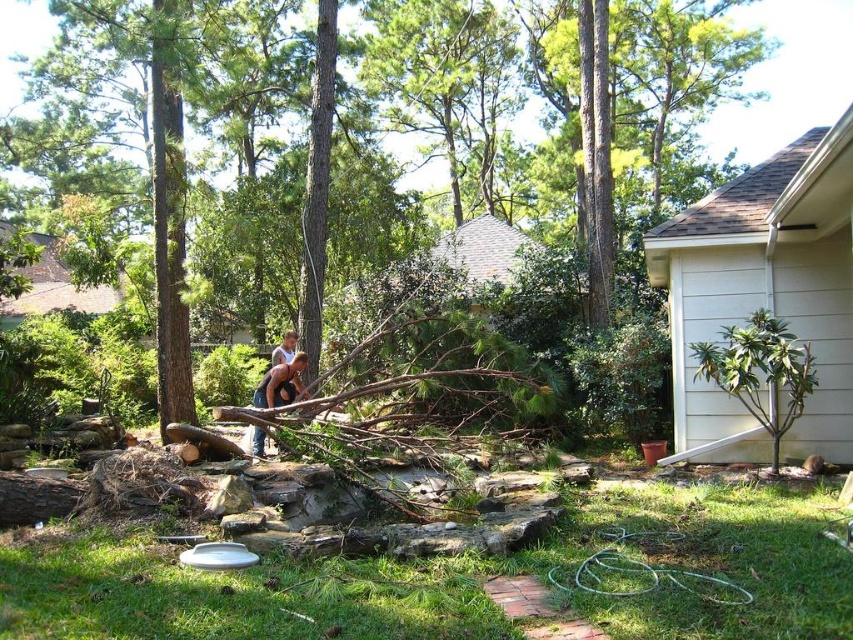
Can you confirm if brown leather boots at center is taller than brown rough wood at center?

In fact, brown leather boots at center may be shorter than brown rough wood at center.

Is brown leather boots at center further to camera compared to brown rough wood at center?

No.

Is point (297, 390) behind point (733, 1)?

No, (297, 390) is closer to viewer.

This screenshot has width=853, height=640. What are the coordinates of `brown leather boots at center` in the screenshot? It's located at (280, 384).